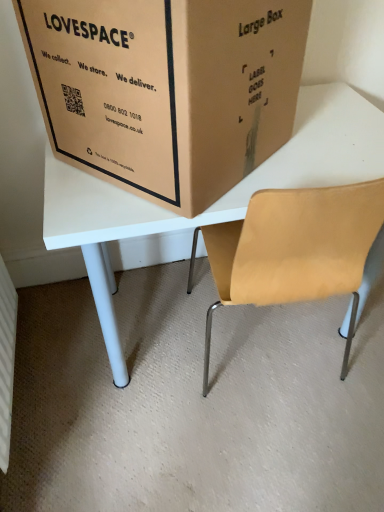
Where is `vacant region in front of matte white table at center`? This screenshot has width=384, height=512. vacant region in front of matte white table at center is located at coordinates (259, 458).